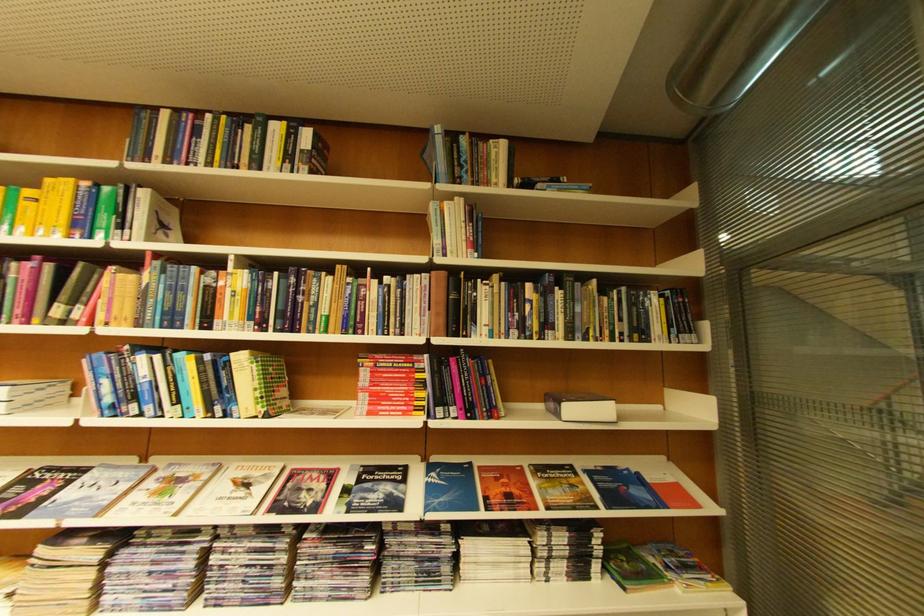
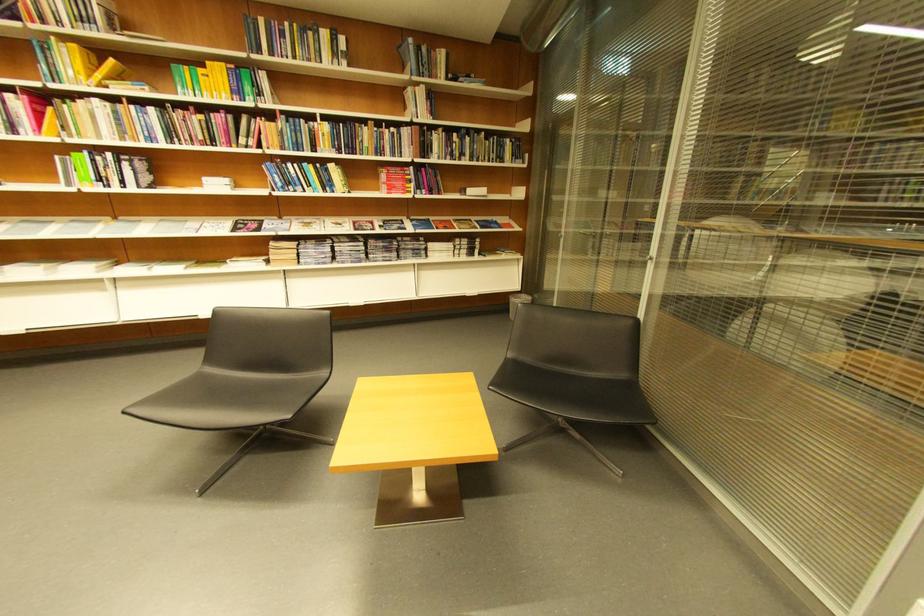
Where in the second image is the point corresponding to [75,323] from the first image?

(258, 148)